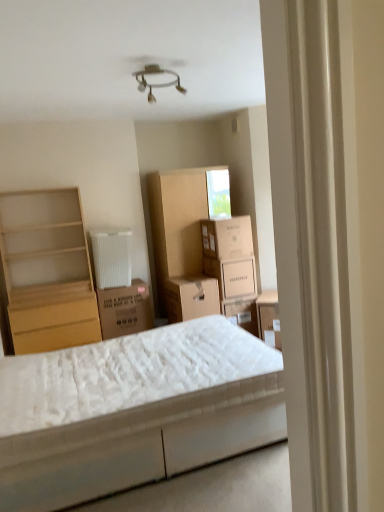
Describe the element at coordinates (269, 316) in the screenshot. The width and height of the screenshot is (384, 512). I see `matte cardboard storage box at center, which is the first storage box from right to left` at that location.

Locate an element on the screen. matte cardboard storage box at center, which ranks as the 2th storage box in left-to-right order is located at coordinates (269, 316).

This screenshot has width=384, height=512. What do you see at coordinates (125, 309) in the screenshot? I see `brown cardboard box at center, marked as the first cardboard box in a left-to-right arrangement` at bounding box center [125, 309].

What is the approximate width of white cardboard box at center, acting as the 3th cardboard box starting from the left?

43.74 centimeters.

This screenshot has width=384, height=512. Describe the element at coordinates (233, 276) in the screenshot. I see `white cardboard box at center, marked as the 2th cardboard box in a top-to-bottom arrangement` at that location.

The height and width of the screenshot is (512, 384). What do you see at coordinates (47, 270) in the screenshot?
I see `light wood shelf at left` at bounding box center [47, 270].

What is the approximate height of white quilted mattress at center?

white quilted mattress at center is 55.38 centimeters tall.

In order to face cardboard cabinet at center, should I rotate leftwards or rightwards?

To face it directly, rotate left by 0.001 degrees.

This screenshot has width=384, height=512. Find the location of `matte cardboard storage box at center, which ranks as the 2th storage box in left-to-right order`. matte cardboard storage box at center, which ranks as the 2th storage box in left-to-right order is located at coordinates (269, 316).

Is there a large distance between light wood shelf at left and brown cardboard box at center, the 2th storage box in the right-to-left sequence?

Yes, light wood shelf at left is far from brown cardboard box at center, the 2th storage box in the right-to-left sequence.

There is a brown cardboard box at center, the 1th storage box in the left-to-right sequence. Where is `shelf above it (from a real-world perspective)`? shelf above it (from a real-world perspective) is located at coordinates (47, 270).

Does light wood shelf at left lie in front of brown cardboard box at center, the 2th storage box in the right-to-left sequence?

Yes.

Based on the photo, between light wood shelf at left and brown cardboard box at center, the 1th storage box in the left-to-right sequence, which one has smaller size?

brown cardboard box at center, the 1th storage box in the left-to-right sequence, is smaller.

From a real-world perspective, which is physically below, brown cardboard box at center, the 1th cardboard box when ordered from bottom to top, or white cardboard box at center, which is the 2th cardboard box from right to left?

brown cardboard box at center, the 1th cardboard box when ordered from bottom to top, from a real-world perspective.

What's the angular difference between brown cardboard box at center, the third cardboard box viewed from the top, and white cardboard box at center, which is the 2th cardboard box from right to left,'s facing directions?

0.571 degrees separate the facing orientations of brown cardboard box at center, the third cardboard box viewed from the top, and white cardboard box at center, which is the 2th cardboard box from right to left.

Is brown cardboard box at center, the 1th cardboard box when ordered from bottom to top, turned away from white cardboard box at center, placed as the first cardboard box when sorted from top to bottom?

brown cardboard box at center, the 1th cardboard box when ordered from bottom to top, is not turned away from white cardboard box at center, placed as the first cardboard box when sorted from top to bottom.

Is brown cardboard box at center, the third cardboard box viewed from the top, in front of or behind white cardboard box at center, acting as the 3th cardboard box starting from the left, in the image?

brown cardboard box at center, the third cardboard box viewed from the top, is positioned closer to the viewer than white cardboard box at center, acting as the 3th cardboard box starting from the left.

Which is more to the right, brown cardboard box at center, marked as the first cardboard box in a left-to-right arrangement, or white cardboard box at center, positioned as the second cardboard box in bottom-to-top order?

white cardboard box at center, positioned as the second cardboard box in bottom-to-top order.

From a real-world perspective, between brown cardboard box at center, marked as the first cardboard box in a left-to-right arrangement, and white cardboard box at center, marked as the 2th cardboard box in a top-to-bottom arrangement, who is vertically higher?

In real-world perspective, white cardboard box at center, marked as the 2th cardboard box in a top-to-bottom arrangement, is above.

Is brown cardboard box at center, the third cardboard box viewed from the top, completely or partially outside of white cardboard box at center, positioned as the second cardboard box in bottom-to-top order?

That's correct, brown cardboard box at center, the third cardboard box viewed from the top, is outside of white cardboard box at center, positioned as the second cardboard box in bottom-to-top order.

Image resolution: width=384 pixels, height=512 pixels. Find the location of `cardboard box that is the 2nd object located below the light wood shelf at left (from the image's perspective)`. cardboard box that is the 2nd object located below the light wood shelf at left (from the image's perspective) is located at coordinates (125, 309).

Looking at this image, which is more to the right, light wood shelf at left or brown cardboard box at center, marked as the first cardboard box in a left-to-right arrangement?

brown cardboard box at center, marked as the first cardboard box in a left-to-right arrangement.

Does light wood shelf at left turn towards brown cardboard box at center, the third cardboard box viewed from the top?

No, light wood shelf at left is not facing towards brown cardboard box at center, the third cardboard box viewed from the top.

What's the angular difference between brown cardboard box at center, the 2th storage box in the right-to-left sequence, and matte cardboard storage box at center, which is the first storage box from right to left,'s facing directions?

brown cardboard box at center, the 2th storage box in the right-to-left sequence, and matte cardboard storage box at center, which is the first storage box from right to left, are facing 40.5 degrees away from each other.

From a real-world perspective, is brown cardboard box at center, the 2th storage box in the right-to-left sequence, physically above matte cardboard storage box at center, which is the first storage box from right to left?

Yes, from a real-world perspective, brown cardboard box at center, the 2th storage box in the right-to-left sequence, is on top of matte cardboard storage box at center, which is the first storage box from right to left.

Is brown cardboard box at center, the 1th storage box in the left-to-right sequence, not close to matte cardboard storage box at center, which is the first storage box from right to left?

brown cardboard box at center, the 1th storage box in the left-to-right sequence, is near matte cardboard storage box at center, which is the first storage box from right to left, not far away.

How much distance is there between white quilted mattress at center and white cardboard box at center, placed as the first cardboard box when sorted from top to bottom?

white quilted mattress at center is 5.78 feet from white cardboard box at center, placed as the first cardboard box when sorted from top to bottom.

Is white quilted mattress at center facing away from white cardboard box at center, placed as the first cardboard box when sorted from top to bottom?

No, white quilted mattress at center is not facing away from white cardboard box at center, placed as the first cardboard box when sorted from top to bottom.

Where is `the 1st cardboard box to the right of the white quilted mattress at center, starting your count from the anchor`? Image resolution: width=384 pixels, height=512 pixels. the 1st cardboard box to the right of the white quilted mattress at center, starting your count from the anchor is located at coordinates [x=227, y=237].

From a real-world perspective, is white quilted mattress at center beneath white cardboard box at center, placed as the first cardboard box when sorted from top to bottom?

Yes, from a real-world perspective, white quilted mattress at center is beneath white cardboard box at center, placed as the first cardboard box when sorted from top to bottom.

In terms of height, does brown cardboard box at center, the 2th storage box in the right-to-left sequence, look taller or shorter compared to white quilted mattress at center?

Clearly, brown cardboard box at center, the 2th storage box in the right-to-left sequence, is taller compared to white quilted mattress at center.

Who is bigger, brown cardboard box at center, the 1th storage box in the left-to-right sequence, or white quilted mattress at center?

white quilted mattress at center is bigger.

Is the depth of brown cardboard box at center, the 1th storage box in the left-to-right sequence, less than that of white quilted mattress at center?

No, brown cardboard box at center, the 1th storage box in the left-to-right sequence, is further to the viewer.

From the image's perspective, is brown cardboard box at center, the 2th storage box in the right-to-left sequence, located above white quilted mattress at center?

Yes, from the image's perspective, brown cardboard box at center, the 2th storage box in the right-to-left sequence, is on top of white quilted mattress at center.

Locate an element on the screen. The height and width of the screenshot is (512, 384). shelf above the brown cardboard box at center, the 1th storage box in the left-to-right sequence (from the image's perspective) is located at coordinates point(47,270).

Find the location of a particular element. Image resolution: width=384 pixels, height=512 pixels. cardboard box in front of the white cardboard box at center, the 2th cardboard box viewed from the left is located at coordinates (125, 309).

From the image, which object appears to be nearer to white quilted mattress at center, light wood shelf at left or matte cardboard storage box at center, which is the first storage box from right to left?

matte cardboard storage box at center, which is the first storage box from right to left, is positioned closer to the anchor white quilted mattress at center.

Considering their positions, is white cardboard box at center, marked as the 2th cardboard box in a top-to-bottom arrangement, positioned closer to cardboard cabinet at center than white quilted mattress at center?

The object closer to cardboard cabinet at center is white cardboard box at center, marked as the 2th cardboard box in a top-to-bottom arrangement.

From the picture: Which object lies further to the anchor point brown cardboard box at center, the 1th storage box in the left-to-right sequence, matte cardboard storage box at center, which ranks as the 2th storage box in left-to-right order, or light wood shelf at left?

Based on the image, light wood shelf at left appears to be further to brown cardboard box at center, the 1th storage box in the left-to-right sequence.

From the image, which object appears to be farther from brown cardboard box at center, marked as the first cardboard box in a left-to-right arrangement, light wood shelf at left or matte cardboard storage box at center, which ranks as the 2th storage box in left-to-right order?

Among the two, matte cardboard storage box at center, which ranks as the 2th storage box in left-to-right order, is located further to brown cardboard box at center, marked as the first cardboard box in a left-to-right arrangement.

Considering their positions, is light wood shelf at left positioned closer to white cardboard box at center, positioned as the second cardboard box in bottom-to-top order, than white cardboard box at center, arranged as the 3th cardboard box when ordered from the bottom?

Based on the image, white cardboard box at center, arranged as the 3th cardboard box when ordered from the bottom, appears to be nearer to white cardboard box at center, positioned as the second cardboard box in bottom-to-top order.

Estimate the real-world distances between objects in this image. Which object is closer to white cardboard box at center, positioned as the second cardboard box in bottom-to-top order, light wood shelf at left or brown cardboard box at center, which is counted as the 3th cardboard box, starting from the right?

The object closer to white cardboard box at center, positioned as the second cardboard box in bottom-to-top order, is brown cardboard box at center, which is counted as the 3th cardboard box, starting from the right.

Based on their spatial positions, is white cardboard box at center, the 2th cardboard box viewed from the left, or cardboard cabinet at center further from matte cardboard storage box at center, which is the first storage box from right to left?

The object further to matte cardboard storage box at center, which is the first storage box from right to left, is cardboard cabinet at center.

Looking at the image, which one is located closer to brown cardboard box at center, the 2th storage box in the right-to-left sequence, white cardboard box at center, the 2th cardboard box viewed from the left, or brown cardboard box at center, the third cardboard box viewed from the top?

brown cardboard box at center, the third cardboard box viewed from the top, is closer to brown cardboard box at center, the 2th storage box in the right-to-left sequence.

Where is `storage box between light wood shelf at left and matte cardboard storage box at center, which is the first storage box from right to left, from left to right`? The width and height of the screenshot is (384, 512). storage box between light wood shelf at left and matte cardboard storage box at center, which is the first storage box from right to left, from left to right is located at coordinates (191, 297).

This screenshot has height=512, width=384. In order to click on cabinet situated between brown cardboard box at center, marked as the first cardboard box in a left-to-right arrangement, and matte cardboard storage box at center, which ranks as the 2th storage box in left-to-right order, from left to right in this screenshot , I will do `click(176, 222)`.

The width and height of the screenshot is (384, 512). I want to click on cabinet situated between light wood shelf at left and white cardboard box at center, which is the 2th cardboard box from right to left, from left to right, so click(x=176, y=222).

Identify the location of cardboard box between brown cardboard box at center, marked as the first cardboard box in a left-to-right arrangement, and white cardboard box at center, acting as the 3th cardboard box starting from the left, in the horizontal direction. The height and width of the screenshot is (512, 384). (227, 237).